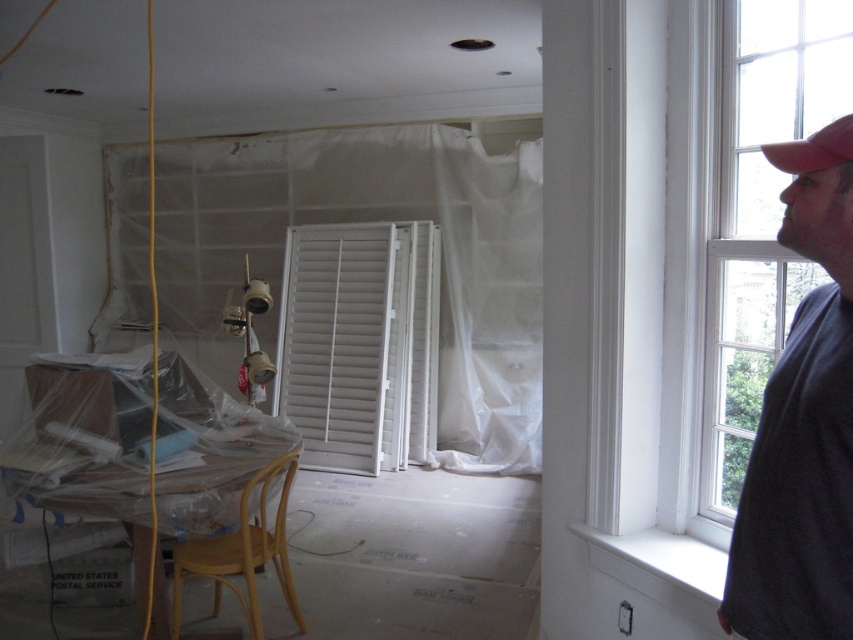
Does point (764, 580) lie behind point (840, 156)?

Yes, point (764, 580) is farther from viewer.

The image size is (853, 640). Identify the location of dark gray t-shirt at right. (804, 422).

You are a GUI agent. You are given a task and a screenshot of the screen. Output one action in this format:
    pyautogui.click(x=<x>, y=<y>)
    Task: Click on the dark gray t-shirt at right
    Image resolution: width=853 pixels, height=640 pixels.
    Given the screenshot: What is the action you would take?
    pyautogui.click(x=804, y=422)

Does dark gray t-shirt at right have a lesser height compared to white plastic curtain at center?

Indeed, dark gray t-shirt at right has a lesser height compared to white plastic curtain at center.

Who is shorter, dark gray t-shirt at right or white plastic curtain at center?

dark gray t-shirt at right

Is point (785, 394) more distant than point (456, 440)?

No.

I want to click on dark gray t-shirt at right, so click(x=804, y=422).

Is white matte shutters at center smaller than light brown wooden stool at lower left?

Actually, white matte shutters at center might be larger than light brown wooden stool at lower left.

Who is positioned more to the right, white matte shutters at center or light brown wooden stool at lower left?

white matte shutters at center is more to the right.

Image resolution: width=853 pixels, height=640 pixels. What are the coordinates of `white matte shutters at center` in the screenshot? It's located at (358, 342).

Locate an element on the screen. This screenshot has width=853, height=640. white matte shutters at center is located at coordinates (358, 342).